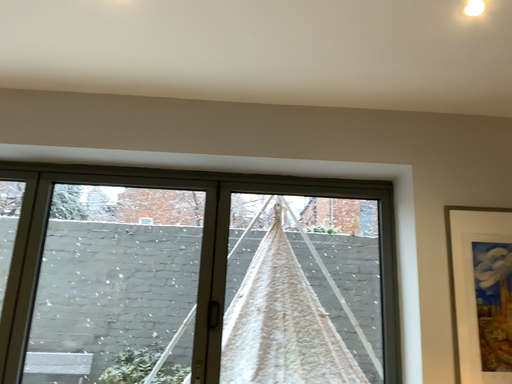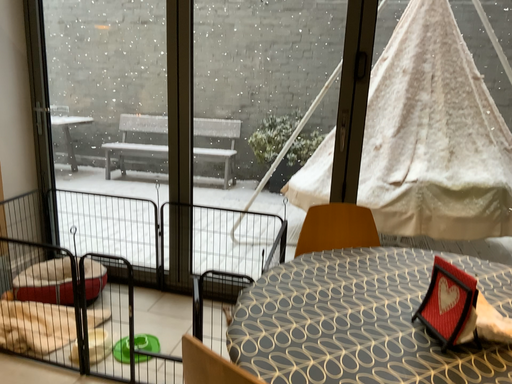
Question: Which way did the camera rotate in the video?

Choices:
 (A) rotated upward
 (B) rotated downward

Answer: (B)